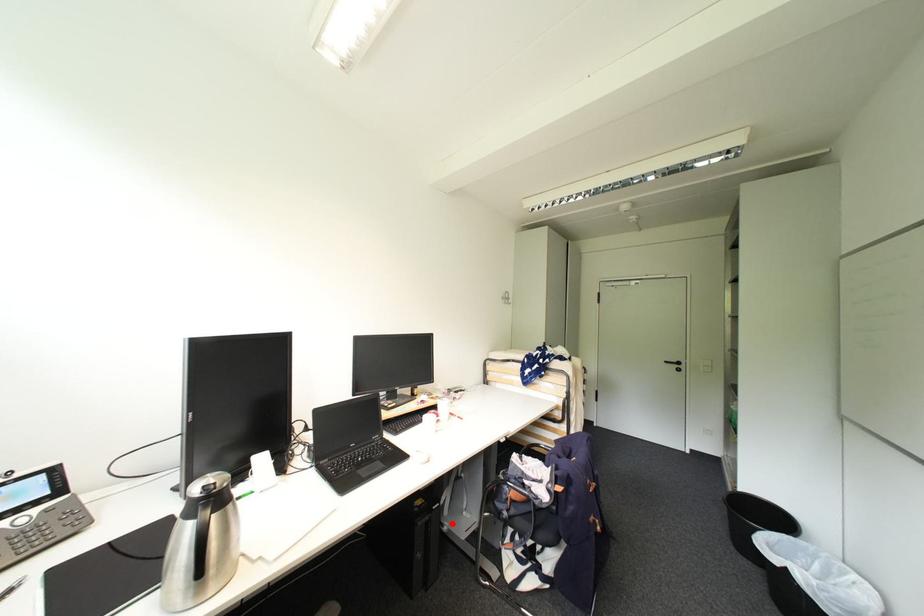
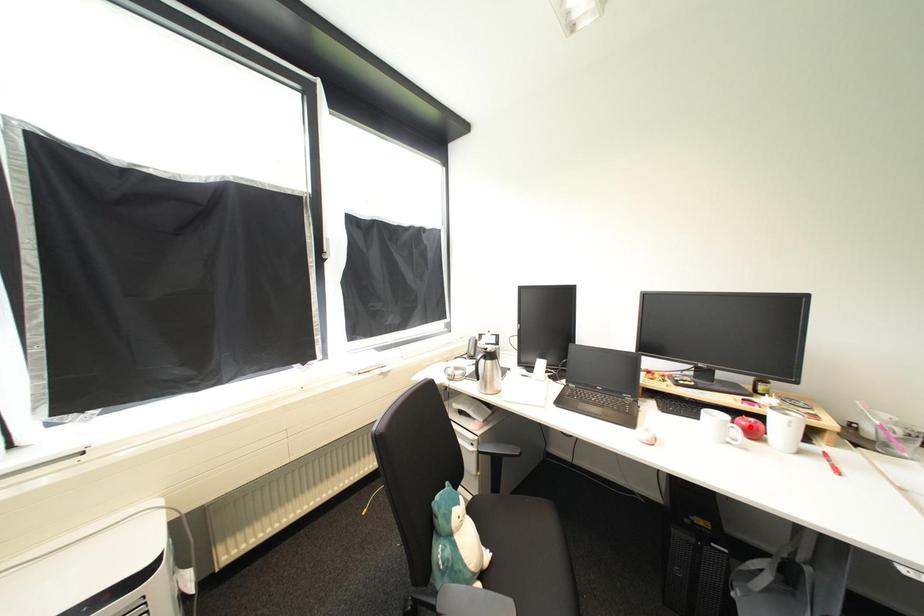
I am providing you with two images of the same scene from different viewpoints. A red point is marked on the first image and another point is marked on the second image. Are the points marked in image1 and image2 representing the same 3D position?

No